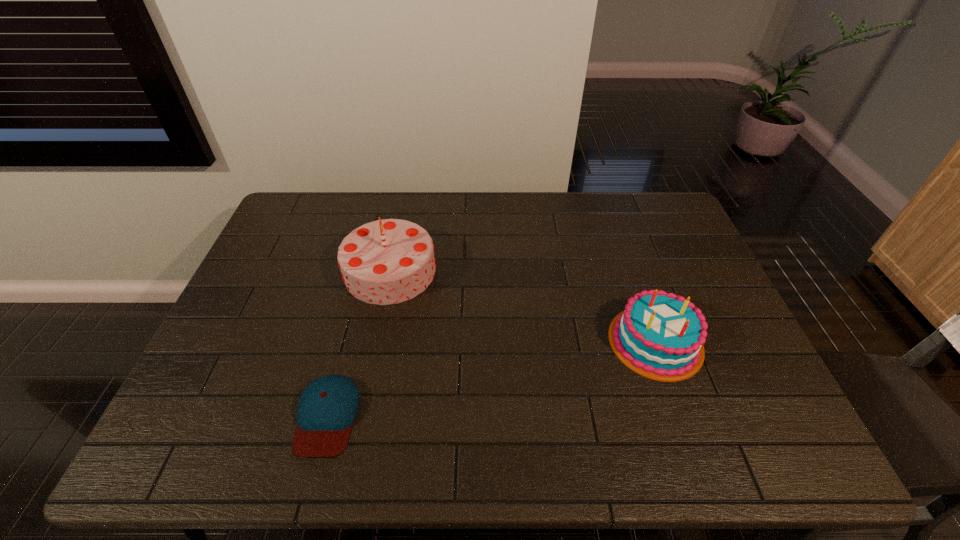
Find the location of a particular element. the taller birthday cake is located at coordinates [389, 261].

You are a GUI agent. You are given a task and a screenshot of the screen. Output one action in this format:
    pyautogui.click(x=<x>, y=<y>)
    Task: Click on the tallest object
    
    Given the screenshot: What is the action you would take?
    pyautogui.click(x=389, y=261)

Identify the location of the shorter birthday cake. (658, 335).

Where is `the second shortest object`? The height and width of the screenshot is (540, 960). the second shortest object is located at coordinates (658, 335).

The height and width of the screenshot is (540, 960). Find the location of `the shortest object`. the shortest object is located at coordinates (327, 408).

At what (x,y) coordinates should I click in order to perform the action: click on free space located on the front of the tallest object. Please return your answer as a coordinate pair (x, y). This screenshot has height=540, width=960. Looking at the image, I should click on (366, 390).

I want to click on free space located on the back of the shorter birthday cake, so click(x=621, y=244).

Image resolution: width=960 pixels, height=540 pixels. In order to click on object that is at the near edge in this screenshot , I will do `click(327, 408)`.

You are a GUI agent. You are given a task and a screenshot of the screen. Output one action in this format:
    pyautogui.click(x=<x>, y=<y>)
    Task: Click on the object that is at the right edge
    The width and height of the screenshot is (960, 540).
    Given the screenshot: What is the action you would take?
    click(x=658, y=335)

This screenshot has width=960, height=540. Identify the location of free location at the far edge of the desktop. (348, 222).